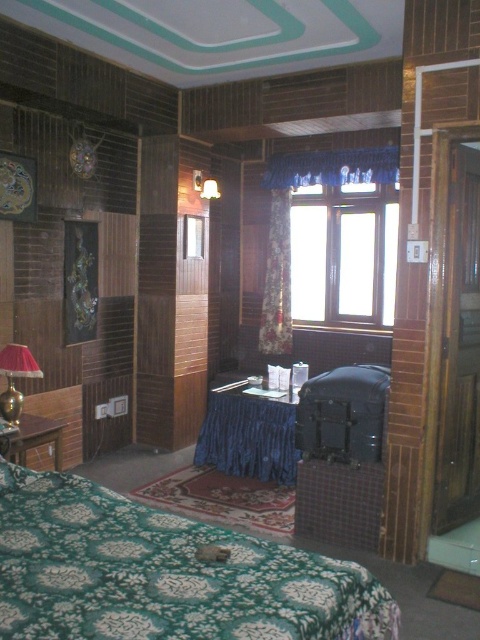
Can you confirm if blue satin table at center is positioned to the right of floral fabric curtain at center?

Incorrect, blue satin table at center is not on the right side of floral fabric curtain at center.

Between point (271, 432) and point (278, 225), which one is positioned behind?

Positioned behind is point (278, 225).

Describe the element at coordinates (248, 435) in the screenshot. The height and width of the screenshot is (640, 480). I see `blue satin table at center` at that location.

What are the coordinates of `blue satin table at center` in the screenshot? It's located at (248, 435).

Does blue satin table at center appear on the left side of wooden table at left?

Incorrect, blue satin table at center is not on the left side of wooden table at left.

Does blue satin table at center lie behind wooden table at left?

That is True.

I want to click on blue satin table at center, so click(x=248, y=435).

I want to click on blue satin table at center, so click(x=248, y=435).

Can you confirm if green floral fabric bed at lower left is positioned below floral fabric curtain at center?

Yes.

Is green floral fabric bed at lower left closer to the viewer compared to floral fabric curtain at center?

Yes, it is.

This screenshot has height=640, width=480. What do you see at coordinates (164, 573) in the screenshot?
I see `green floral fabric bed at lower left` at bounding box center [164, 573].

Where is `green floral fabric bed at lower left`? green floral fabric bed at lower left is located at coordinates (164, 573).